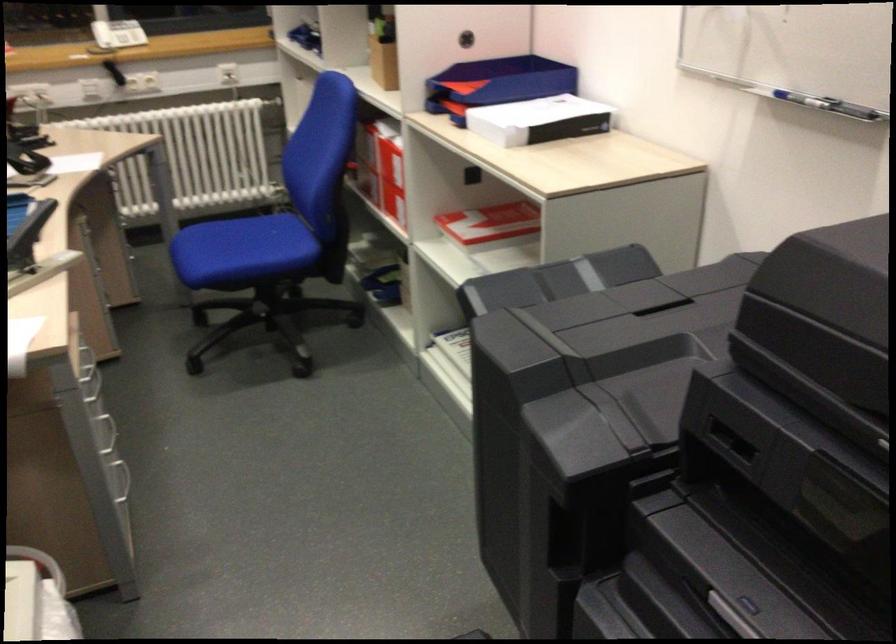
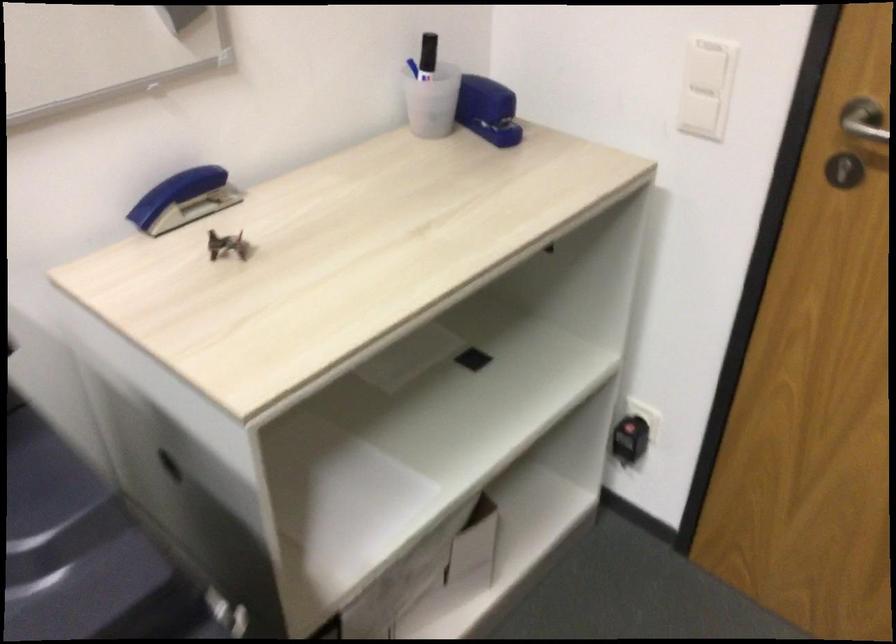
First-person continuous shooting, in which direction is the camera rotating?

The rotation direction of the camera is right-down.